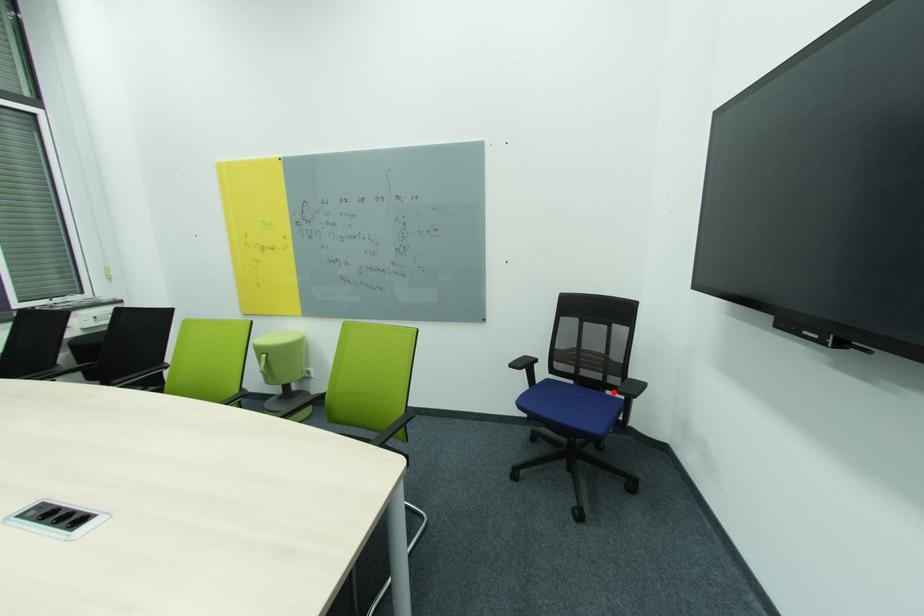
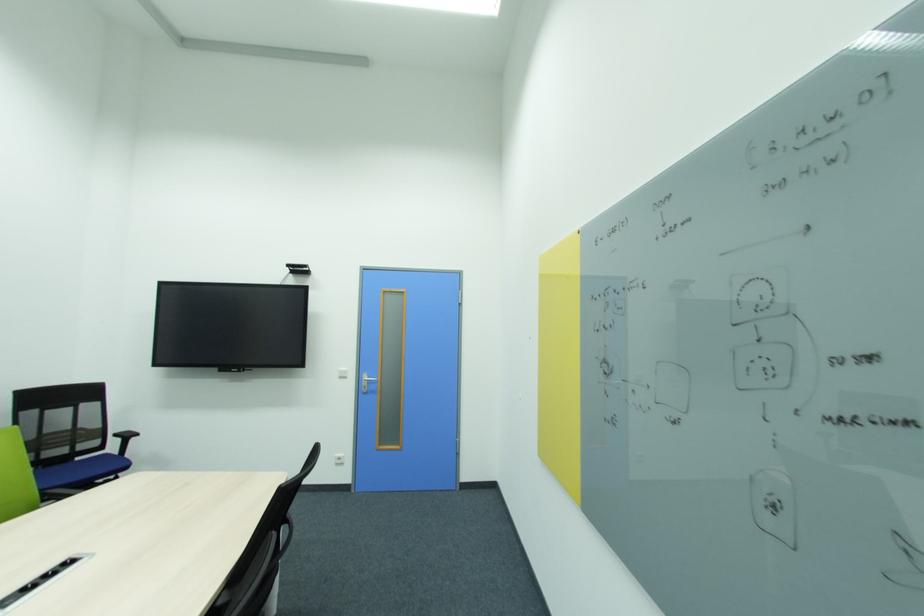
The point at the highlighted location is marked in the first image. Where is the corresponding point in the second image?

(82, 460)